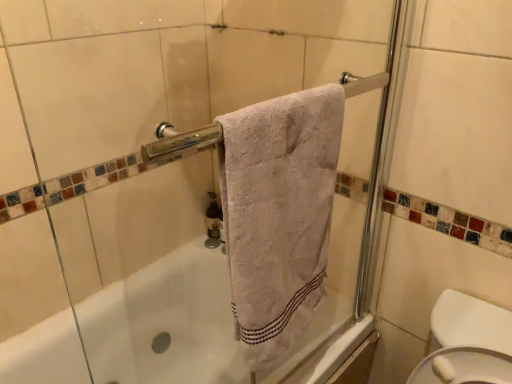
Question: From the image's perspective, is white textured towel at center positioned above or below matte brown soap dispenser at center?

Choices:
 (A) below
 (B) above

Answer: (B)

Question: Considering their positions, is white textured towel at center located in front of or behind matte brown soap dispenser at center?

Choices:
 (A) front
 (B) behind

Answer: (A)

Question: In terms of height, does white textured towel at center look taller or shorter compared to matte brown soap dispenser at center?

Choices:
 (A) short
 (B) tall

Answer: (B)

Question: Is matte brown soap dispenser at center in front of or behind white textured towel at center in the image?

Choices:
 (A) behind
 (B) front

Answer: (A)

Question: Based on their sizes in the image, would you say matte brown soap dispenser at center is bigger or smaller than white textured towel at center?

Choices:
 (A) big
 (B) small

Answer: (B)

Question: Considering the positions of matte brown soap dispenser at center and white textured towel at center in the image, is matte brown soap dispenser at center taller or shorter than white textured towel at center?

Choices:
 (A) tall
 (B) short

Answer: (B)

Question: Which is correct: matte brown soap dispenser at center is inside white textured towel at center, or outside of it?

Choices:
 (A) inside
 (B) outside

Answer: (B)